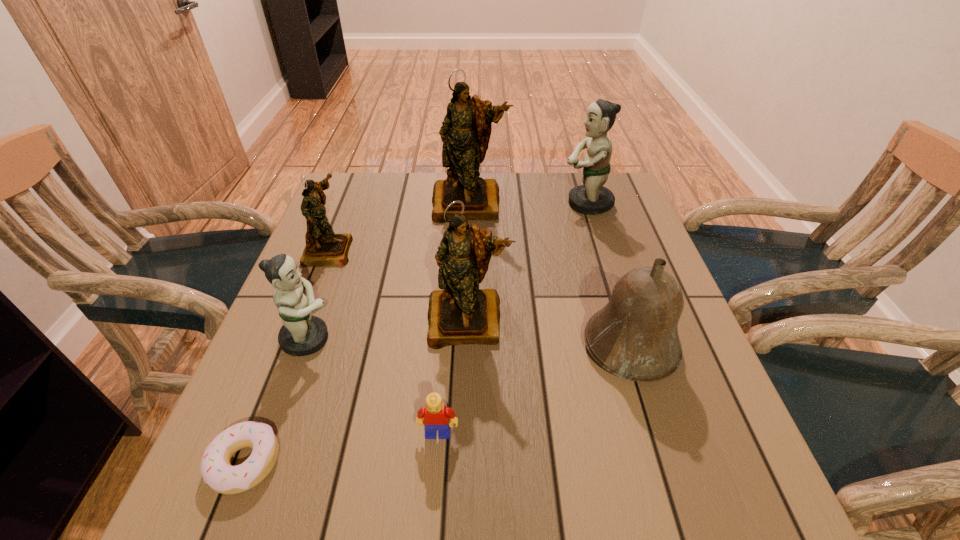
Locate which object ranks seventh in proximity to the farthest gold figurine. Please provide its 2D coordinates. Your answer should be formatted as a tuple, i.e. [(x, y)], where the tuple contains the x and y coordinates of a point satisfying the conditions above.

[(222, 477)]

Point out which figurine is positioned as the fourth nearest to the bell. Please provide its 2D coordinates. Your answer should be formatted as a tuple, i.e. [(x, y)], where the tuple contains the x and y coordinates of a point satisfying the conditions above.

[(302, 334)]

Identify the location of figurine that can be found as the third closest to the right green figurine. This screenshot has width=960, height=540. (323, 247).

Identify which gold figurine is the closest to the rightmost figurine. Please provide its 2D coordinates. Your answer should be formatted as a tuple, i.e. [(x, y)], where the tuple contains the x and y coordinates of a point satisfying the conditions above.

[(466, 129)]

The height and width of the screenshot is (540, 960). I want to click on gold figurine that is the second closest one to the white doughnut, so click(323, 247).

The height and width of the screenshot is (540, 960). In order to click on vacant space that satisfies the following two spatial constraints: 1. on the front-facing side of the bell; 2. on the right side of the smaller green figurine in this screenshot , I will do `click(306, 346)`.

Image resolution: width=960 pixels, height=540 pixels. I want to click on free space that satisfies the following two spatial constraints: 1. on the front-facing side of the biggest gold figurine; 2. on the front-facing side of the third farthest object, so click(x=468, y=250).

This screenshot has width=960, height=540. Identify the location of blank area in the image that satisfies the following two spatial constraints: 1. on the front-facing side of the farthest gold figurine; 2. on the front-facing side of the nearer green figurine. (465, 339).

Find the location of a particular element. free space that satisfies the following two spatial constraints: 1. on the front-facing side of the bigger green figurine; 2. on the face of the Lego is located at coordinates (659, 434).

This screenshot has height=540, width=960. In order to click on vacant space that satisfies the following two spatial constraints: 1. on the front-facing side of the bell; 2. on the right side of the farthest gold figurine in this screenshot , I will do `click(465, 346)`.